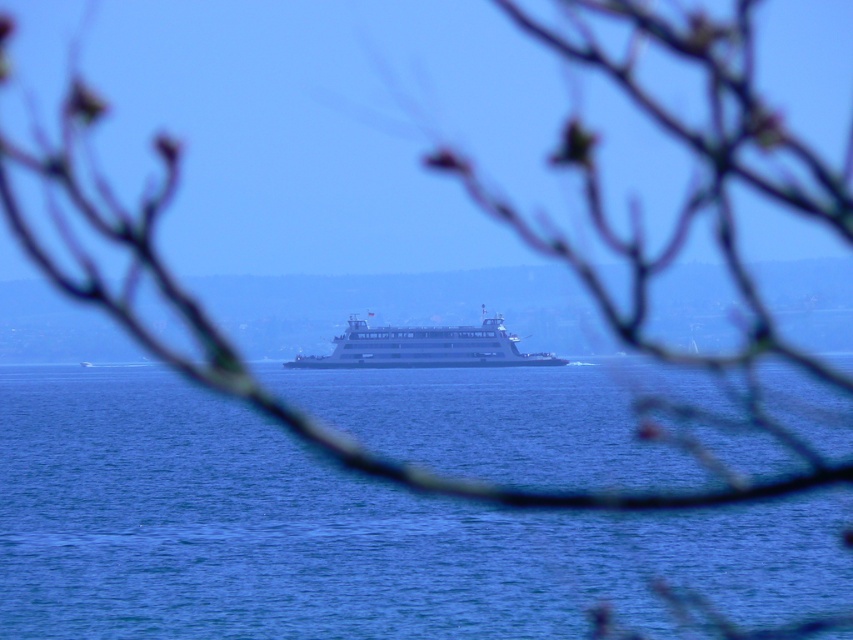
Question: Can you confirm if blue water at center is positioned to the right of white glossy ferry at center?

Choices:
 (A) yes
 (B) no

Answer: (B)

Question: Can you confirm if blue water at center is smaller than white glossy ferry at center?

Choices:
 (A) no
 (B) yes

Answer: (A)

Question: Which of the following is the farthest from the observer?

Choices:
 (A) (93, 611)
 (B) (412, 333)

Answer: (B)

Question: Which point is closer to the camera?

Choices:
 (A) white glossy ferry at center
 (B) blue water at center

Answer: (B)

Question: Does blue water at center have a lesser width compared to white glossy ferry at center?

Choices:
 (A) no
 (B) yes

Answer: (A)